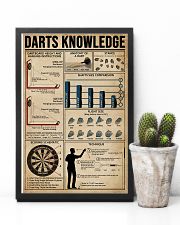
Identify the location of black frame. click(131, 109).